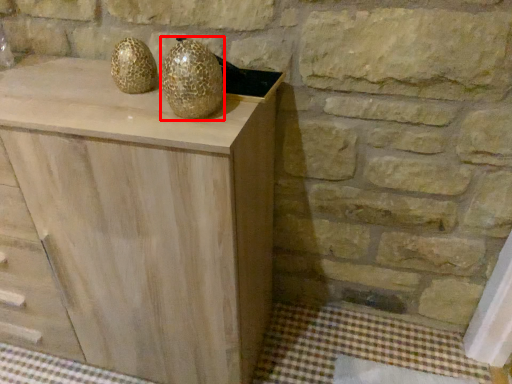
Question: From the image's perspective, what is the correct spatial positioning of glass vase (annotated by the red box) in reference to chest of drawers?

Choices:
 (A) below
 (B) above

Answer: (B)